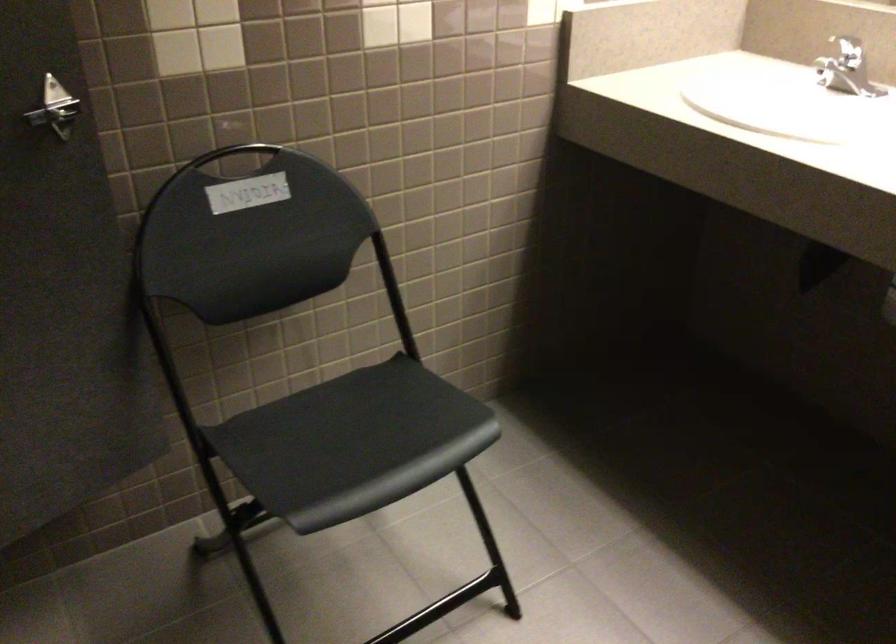
What are the coordinates of `metal coat hook` in the screenshot? It's located at (57, 99).